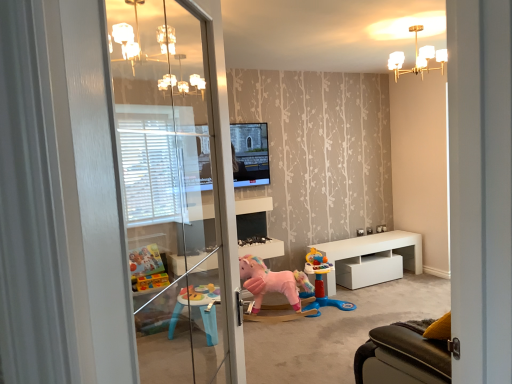
Question: From a real-world perspective, is transparent glass screen door at left above or below white glossy table at lower right?

Choices:
 (A) above
 (B) below

Answer: (A)

Question: Is transparent glass screen door at left in front of or behind white glossy table at lower right in the image?

Choices:
 (A) front
 (B) behind

Answer: (A)

Question: Which object is positioned farthest from the pink plush rocking horse at center, positioned as the second toy in right-to-left order?

Choices:
 (A) white glossy table at lower right
 (B) matte black television at center
 (C) gold metallic chandelier at upper center
 (D) transparent glass screen door at left
 (E) pink plush unicorn at center, which is the first toy from right to left

Answer: (C)

Question: Which object is the farthest from the pink plush unicorn at center, which is the first toy from right to left?

Choices:
 (A) transparent glass screen door at left
 (B) white glossy table at lower right
 (C) pink plush rocking horse at center, arranged as the 1th toy when viewed from the left
 (D) gold metallic chandelier at upper center
 (E) matte black television at center

Answer: (D)